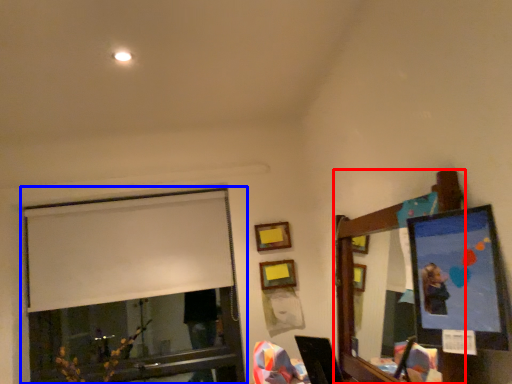
Question: Which of the following is the closest to the observer, mirror (highlighted by a red box) or window (highlighted by a blue box)?

Choices:
 (A) mirror
 (B) window

Answer: (A)